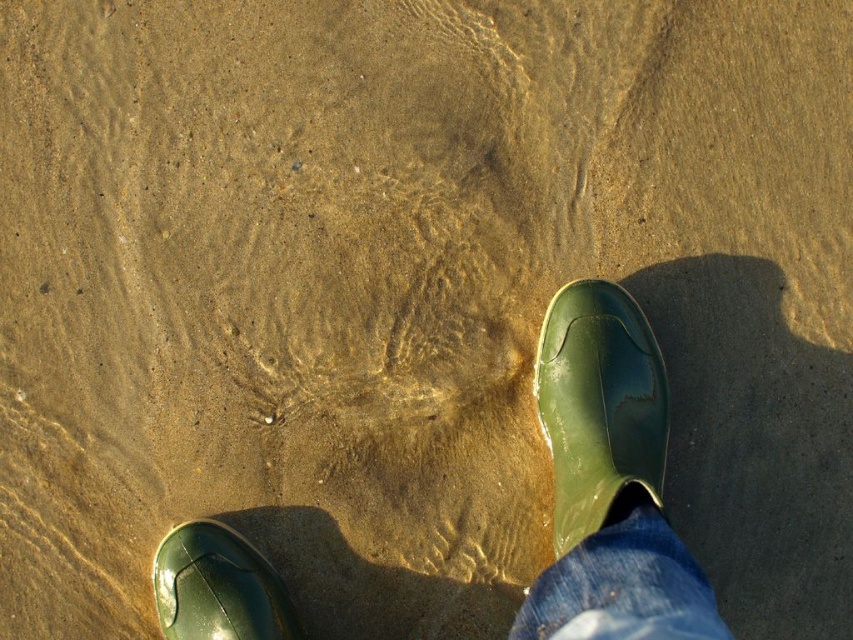
Who is shorter, green rubber boots at center or green rubber boot at right?

green rubber boot at right

Image resolution: width=853 pixels, height=640 pixels. What do you see at coordinates (608, 481) in the screenshot?
I see `green rubber boots at center` at bounding box center [608, 481].

Locate an element on the screen. The image size is (853, 640). green rubber boots at center is located at coordinates (608, 481).

Is green rubber boots at center further to the viewer compared to green rubber boot at lower left?

No, green rubber boots at center is in front of green rubber boot at lower left.

Between point (621, 340) and point (215, 540), which one is positioned in front?

Point (215, 540) is in front.

Where is `green rubber boots at center`? Image resolution: width=853 pixels, height=640 pixels. green rubber boots at center is located at coordinates (608, 481).

Looking at this image, is green rubber boots at center bigger than denim at lower right?

Correct, green rubber boots at center is larger in size than denim at lower right.

Does point (642, 404) come farther from viewer compared to point (567, 592)?

Yes.

Where is `green rubber boots at center`? The width and height of the screenshot is (853, 640). green rubber boots at center is located at coordinates [608, 481].